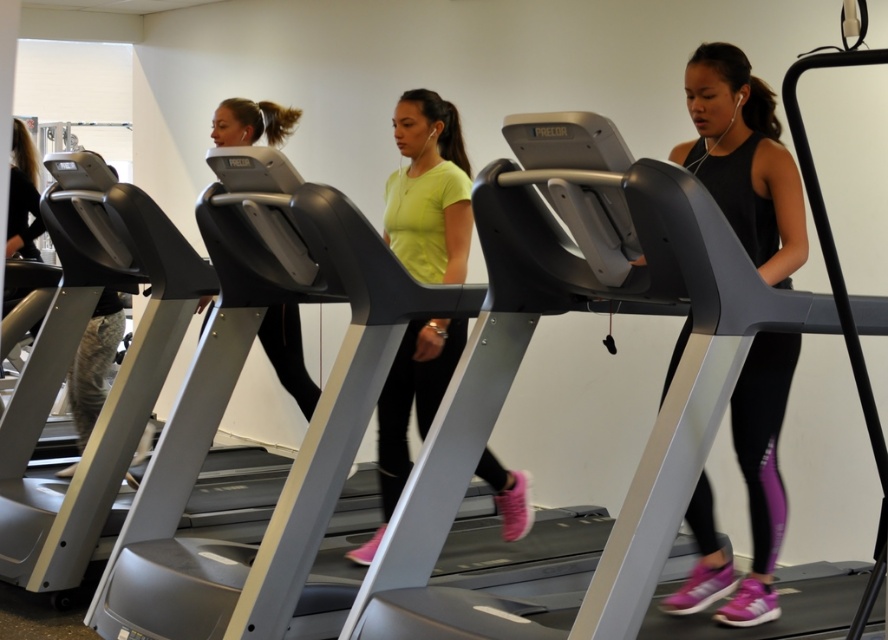
You are a fitness instructor observing the workout session. You need to adjust the treadmill settings for the person in the black matte tank top at center. Since you can only reach up to 1.5 meters, can you comfortably access the control panel of the matte black treadmill at center from your current position?

The black matte tank top at center is closer to the viewer than the matte black treadmill at center. Since the person in the black matte tank top at center is closer, the distance to the treadmill control panel may be within your reach. However, without knowing the exact distance between the person and the treadmill, it is difficult to determine if the 1.5 meters reach is sufficient. Consider moving closer or asking the participant for assistance.